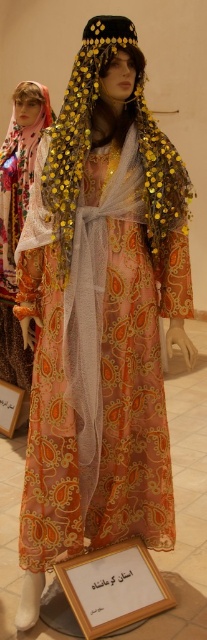
You are standing in front of the mannequin display and need to place a small decorative item exactly at the center of the wooden plaque at lower center. What are the coordinates where you should place the item?

The coordinates for the wooden plaque at lower center are at point [114,588], so you should place the item at those coordinates.

You are an artist sketching the scene and need to place the matte white scarf at left accurately. According to the coordinates provided, where should you position it on your drawing canvas?

The matte white scarf at left should be positioned at the coordinates point (18, 216) on the drawing canvas.